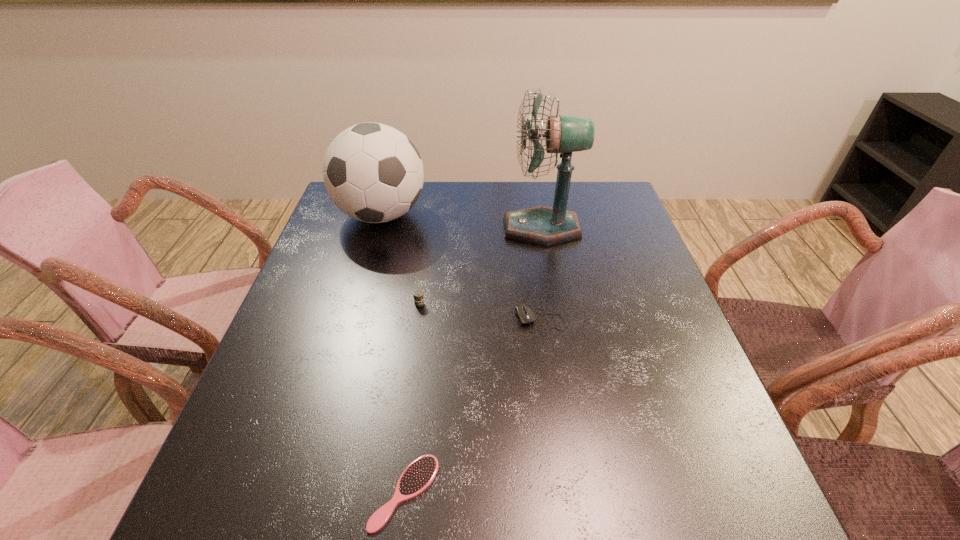
Find the location of a particular element. fan is located at coordinates (541, 225).

This screenshot has height=540, width=960. I want to click on soccer ball, so click(372, 172).

Image resolution: width=960 pixels, height=540 pixels. Find the location of `the third shortest object`. the third shortest object is located at coordinates (418, 295).

I want to click on computer mouse, so click(x=526, y=316).

I want to click on the nearest object, so click(x=419, y=474).

Locate an element on the screen. the shortest object is located at coordinates (419, 474).

The width and height of the screenshot is (960, 540). Identify the location of vacant space located in front of the tallest object where the wind blows. (391, 228).

The width and height of the screenshot is (960, 540). What are the coordinates of `vacant space located 0.160m in front of the tallest object where the wind blows` in the screenshot? It's located at (447, 228).

In order to click on vacant space located 0.250m in front of the tallest object where the wind blows in this screenshot , I will do `click(415, 228)`.

The image size is (960, 540). I want to click on free space located on the right of the second tallest object, so click(x=557, y=215).